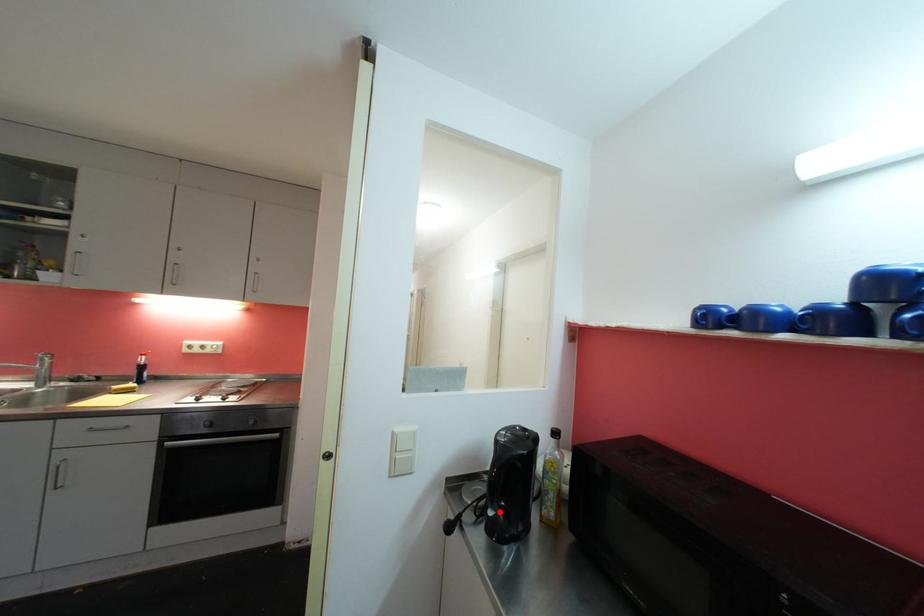
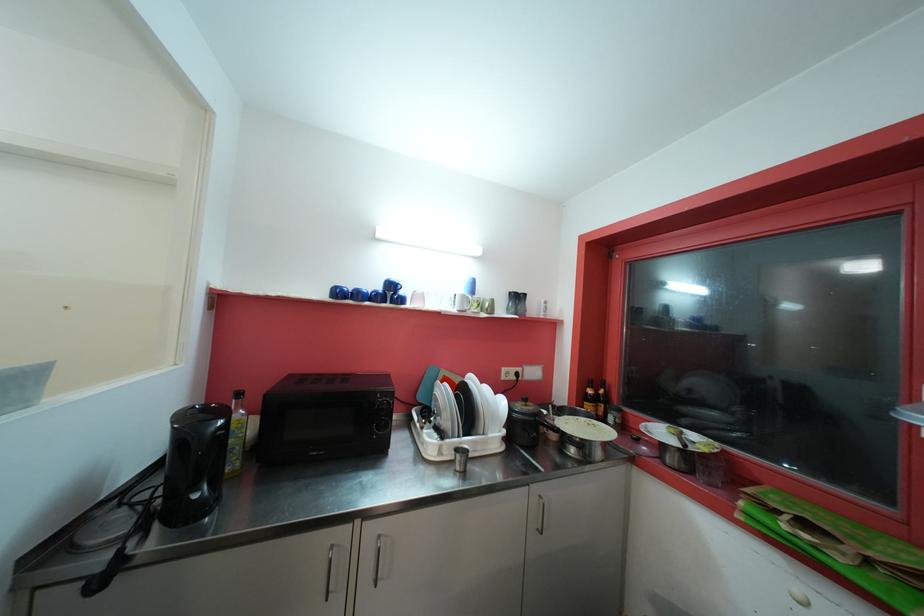
The point at the highlighted location is marked in the first image. Where is the corresponding point in the second image?

(203, 492)